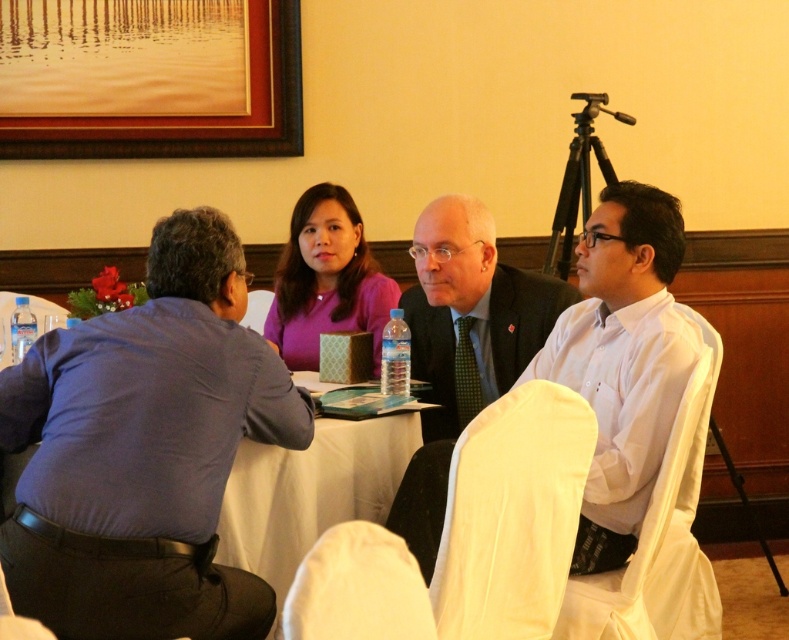
Which is more to the left, clear plastic bottle at center or clear plastic bottle at table left?

From the viewer's perspective, clear plastic bottle at table left appears more on the left side.

Which is behind, point (386, 323) or point (17, 317)?

Point (386, 323)

Describe the element at coordinates (395, 355) in the screenshot. I see `clear plastic bottle at center` at that location.

Identify the location of clear plastic bottle at center. This screenshot has height=640, width=789. (395, 355).

Which is more to the left, dark gray suit at center or clear plastic bottle at table left?

Positioned to the left is clear plastic bottle at table left.

Is dark gray suit at center positioned at the back of clear plastic bottle at table left?

Yes.

In order to click on dark gray suit at center in this screenshot , I will do `click(470, 310)`.

Locate an element on the screen. The image size is (789, 640). dark gray suit at center is located at coordinates (470, 310).

Can you confirm if blue fabric shirt at left is smaller than brown wooden picture frame at upper left?

No.

Is blue fabric shirt at left positioned at the back of brown wooden picture frame at upper left?

No, it is in front of brown wooden picture frame at upper left.

You are a GUI agent. You are given a task and a screenshot of the screen. Output one action in this format:
    pyautogui.click(x=<x>, y=<y>)
    Task: Click on the blue fabric shirt at left
    
    Given the screenshot: What is the action you would take?
    pyautogui.click(x=144, y=451)

Identify the location of blue fabric shirt at left. The width and height of the screenshot is (789, 640). (144, 451).